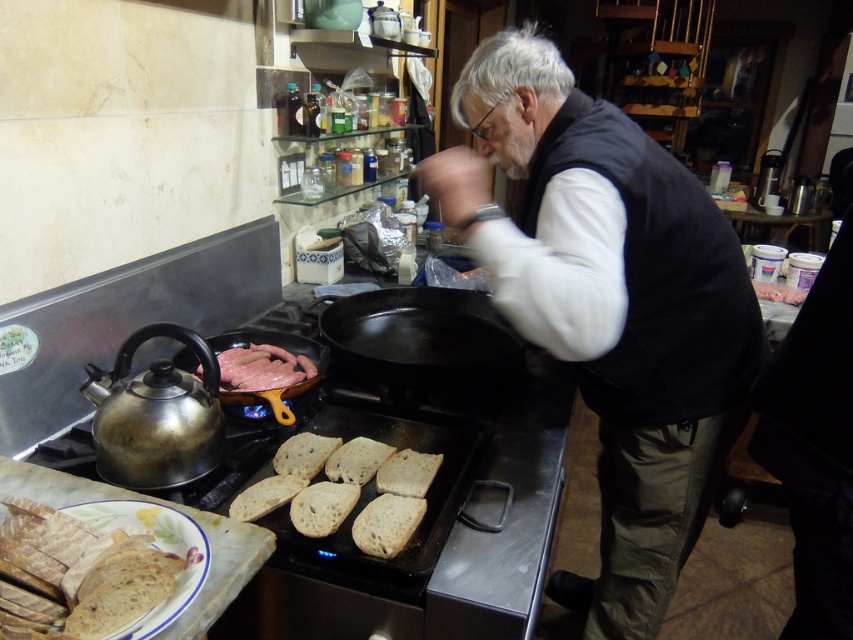
Between black cast iron frying pan at center and pink raw meat at center, which one is positioned lower?

pink raw meat at center is lower down.

Is black cast iron frying pan at center wider than pink raw meat at center?

Yes, black cast iron frying pan at center is wider than pink raw meat at center.

In order to click on black cast iron frying pan at center in this screenshot , I will do `click(422, 340)`.

The height and width of the screenshot is (640, 853). What are the coordinates of `black cast iron frying pan at center` in the screenshot? It's located at (422, 340).

Is point (177, 460) positioned in front of point (318, 493)?

Yes, point (177, 460) is in front of point (318, 493).

Can you confirm if shiny metallic kettle at left is positioned below brown crusty bread at center?

Actually, shiny metallic kettle at left is above brown crusty bread at center.

Which is in front, point (149, 429) or point (328, 458)?

Positioned in front is point (149, 429).

Find the location of a particular element. This screenshot has height=640, width=853. shiny metallic kettle at left is located at coordinates (155, 413).

Between point (646, 444) and point (349, 460), which one is positioned behind?

Point (646, 444)

Which is more to the right, black matte vest at center or brown crusty bread at center?

From the viewer's perspective, black matte vest at center appears more on the right side.

Between point (537, 86) and point (335, 497), which one is positioned in front?

Point (335, 497)

Where is `black matte vest at center`? This screenshot has width=853, height=640. black matte vest at center is located at coordinates (608, 305).